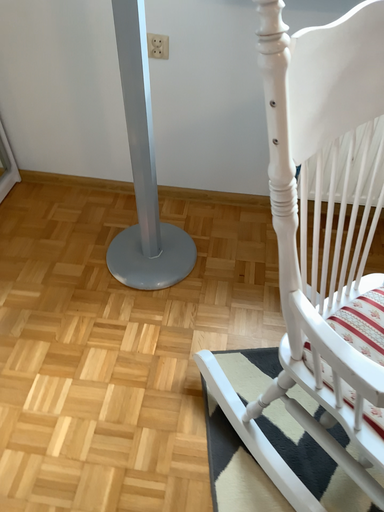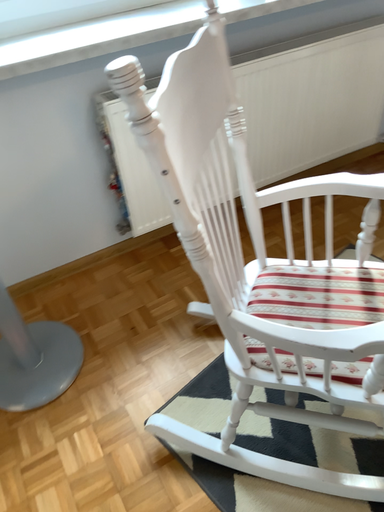
Question: Which way did the camera rotate in the video?

Choices:
 (A) rotated upward
 (B) rotated downward

Answer: (A)